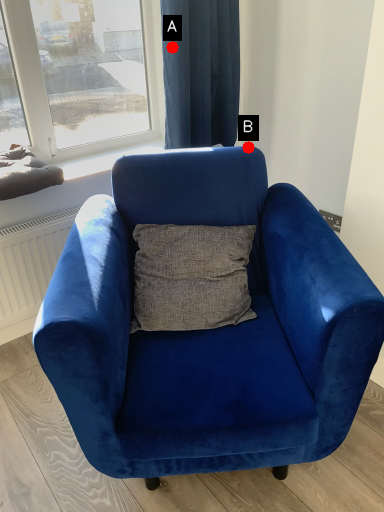
Question: Two points are circled on the image, labeled by A and B beside each circle. Which point is further to the camera?

Choices:
 (A) A is further
 (B) B is further

Answer: (B)